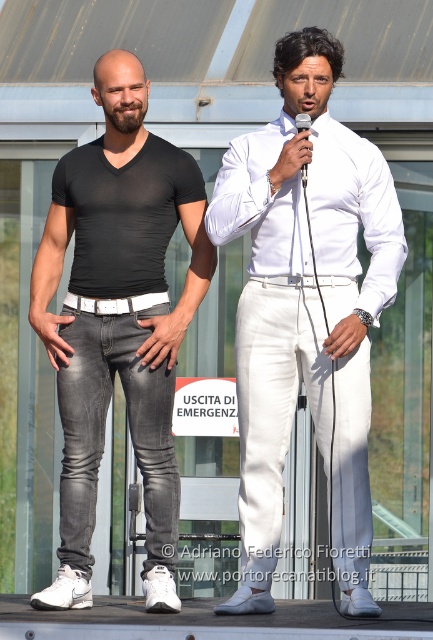
You are a stagehand adjusting the lighting for the performance. You need to ensure that the white linen pants at center and the white leather belt at center are both clearly visible. Given their height difference, which object should you focus the spotlight on first to ensure it doesn

The white linen pants at center is much taller than the white leather belt at center, so you should focus the spotlight on the white linen pants at center first to ensure it is illuminated properly before adjusting for the shorter belt.

You are an event photographer positioned at the back of the stage. You need to capture a photo that includes both the dark gray denim jeans at left and the white leather belt at center. Based on their positions, which object should you focus on first to ensure both are in frame?

The dark gray denim jeans at left is to the right of the white leather belt at center, so you should focus on the white leather belt at center first to ensure both are in frame.